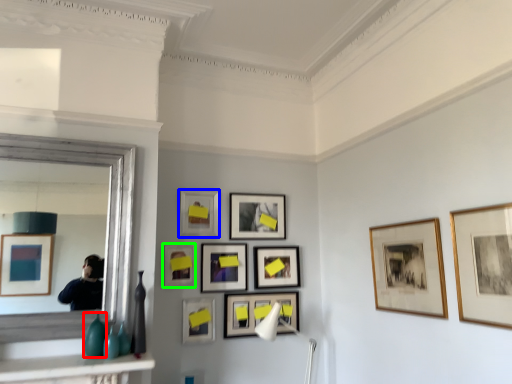
Question: Which object is positioned farthest from glass vase (highlighted by a red box)? Select from picture frame (highlighted by a blue box) and picture frame (highlighted by a green box).

Choices:
 (A) picture frame
 (B) picture frame

Answer: (A)